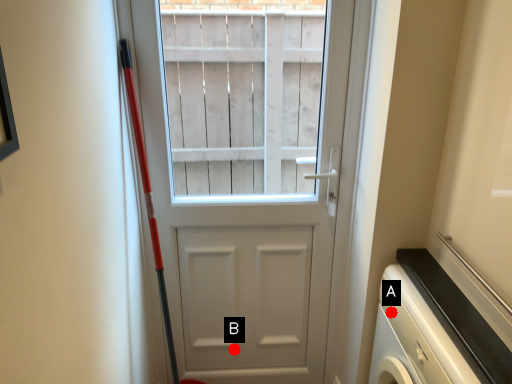
Question: Two points are circled on the image, labeled by A and B beside each circle. Which point appears farthest from the camera in this image?

Choices:
 (A) A is further
 (B) B is further

Answer: (B)